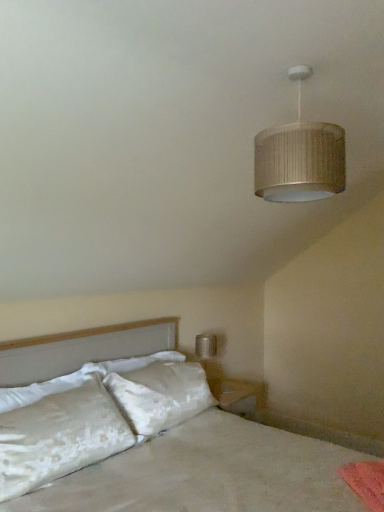
Identify the location of free location above matte silver lampshade at upper right (from a real-world perspective). Image resolution: width=384 pixels, height=512 pixels. (311, 58).